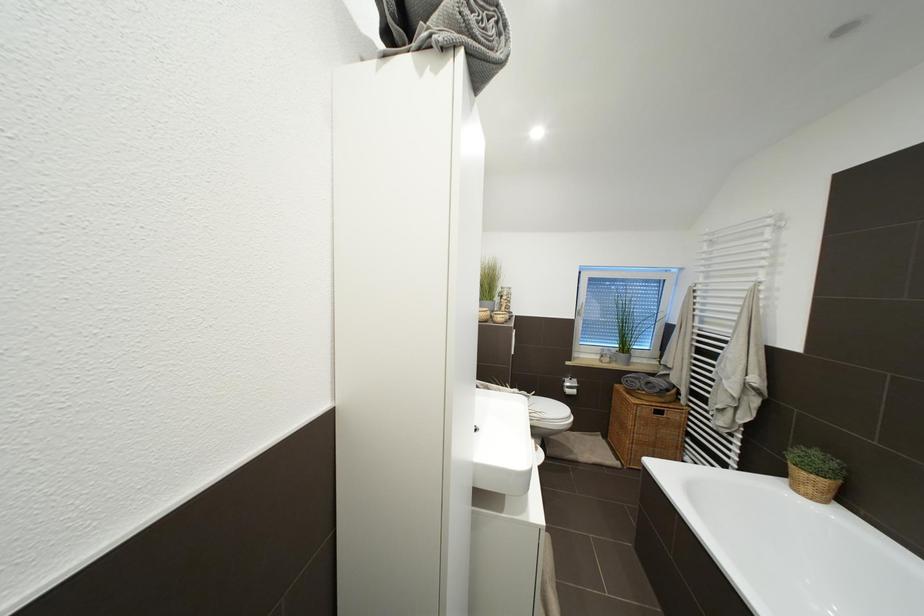
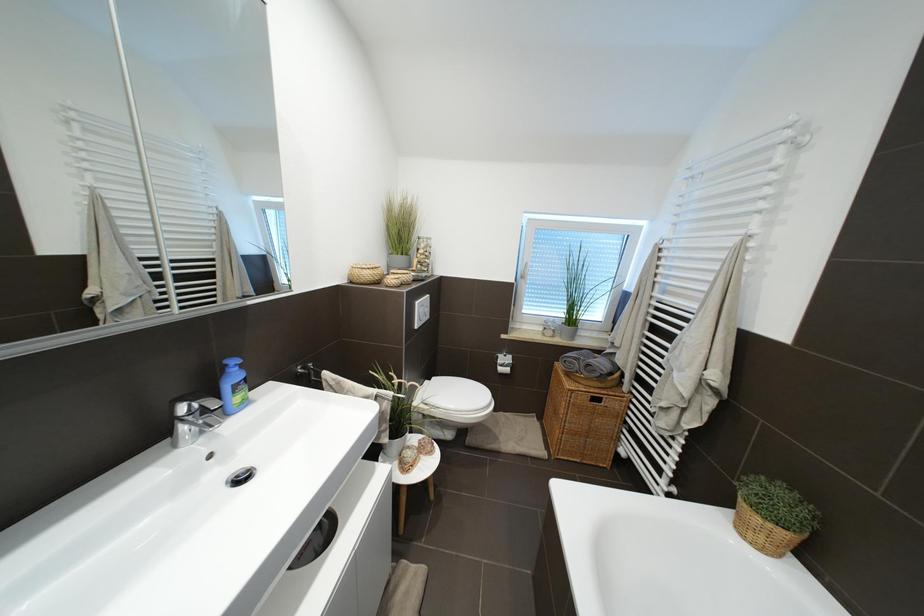
Question: The images are taken continuously from a first-person perspective. In which direction is your viewpoint rotating?

Choices:
 (A) Left
 (B) Right
 (C) Up
 (D) Down

Answer: (D)